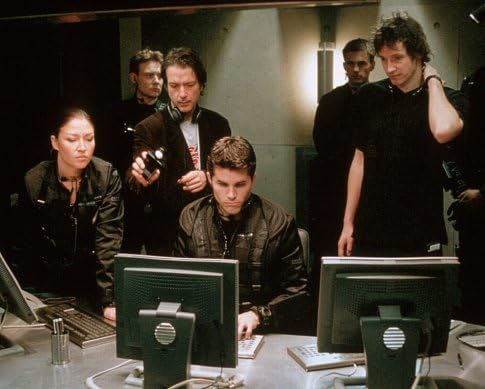
Locate an element on the screen. beige wall is located at coordinates (264, 75).